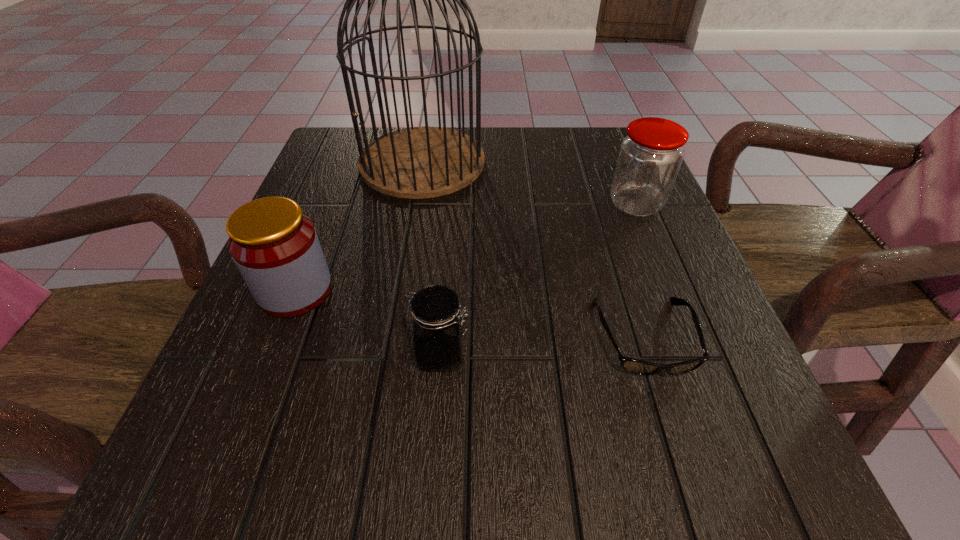
Where is `vacant area situated on the front-facing side of the spectacles`? vacant area situated on the front-facing side of the spectacles is located at coordinates 695,496.

Identify the location of object present at the far edge. (416, 162).

Identify the location of birdcage at the left edge. The height and width of the screenshot is (540, 960). (416, 162).

Locate an element on the screen. jar present at the left edge is located at coordinates (275, 247).

At what (x,y) coordinates should I click in order to perform the action: click on jar at the right edge. Please return your answer as a coordinate pair (x, y). Looking at the image, I should click on (650, 156).

Locate an element on the screen. Image resolution: width=960 pixels, height=540 pixels. spectacles at the right edge is located at coordinates (635, 366).

This screenshot has width=960, height=540. Identify the location of object that is positioned at the far left corner. (416, 162).

The height and width of the screenshot is (540, 960). In order to click on free region at the far edge of the desktop in this screenshot , I will do `click(483, 134)`.

Identify the location of vacant area at the left edge. The height and width of the screenshot is (540, 960). (324, 224).

In the image, there is a desktop. What are the coordinates of `vacant space at the right edge` in the screenshot? It's located at (656, 345).